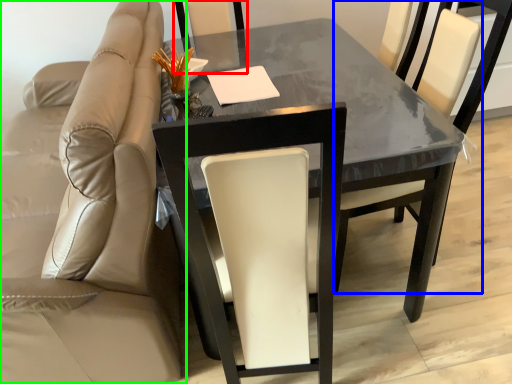
Question: Considering the real-world distances, which object is closest to chair (highlighted by a red box)? chair (highlighted by a blue box) or chair (highlighted by a green box).

Choices:
 (A) chair
 (B) chair

Answer: (B)